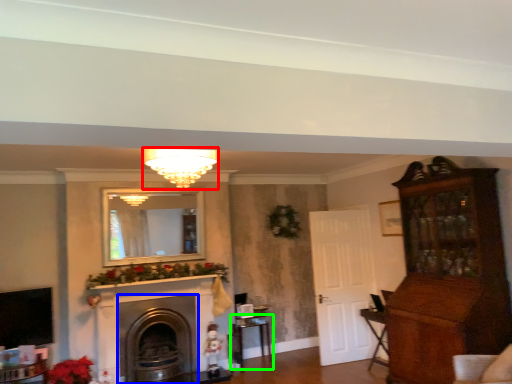
Question: Estimate the real-world distances between objects in this image. Which object is closer to light fixture (highlighted by a red box), fireplace (highlighted by a blue box) or table (highlighted by a green box)?

Choices:
 (A) fireplace
 (B) table

Answer: (A)